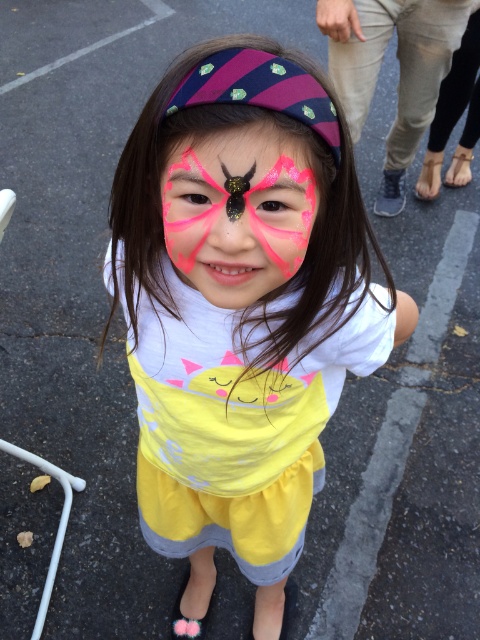
A child is wearing a matte white shirt at center and has a pink glitter butterfly at center on their face. If the distance between the two is 12.01 inches, can a 12 inch wide ruler placed horizontally between them fit without overlapping?

The distance between the matte white shirt at center and the pink glitter butterfly at center is 12.01 inches. Since the ruler is 12 inches wide, it can fit between them without overlapping as the space is slightly larger than the ruler.

The child is wearing a matte white shirt at center and has a pink glitter butterfly at center on their face. If the child bends forward to pick up a toy from the ground, which item will be closer to the ground?

The matte white shirt at center will be closer to the ground because it is located below the pink glitter butterfly at center.